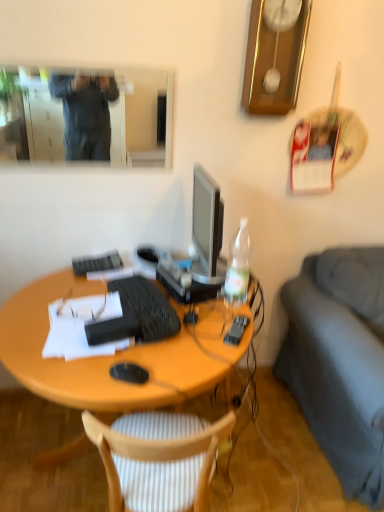
This screenshot has width=384, height=512. What are the coordinates of `empty space that is ontop of wooden desk at center (from a real-world perspective)` in the screenshot? It's located at (115, 303).